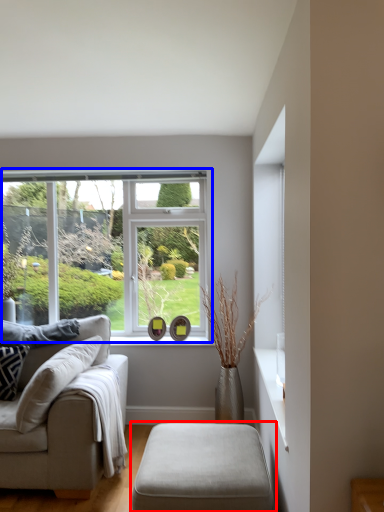
Question: Which object is further to the camera taking this photo, table (highlighted by a red box) or window (highlighted by a blue box)?

Choices:
 (A) table
 (B) window

Answer: (B)